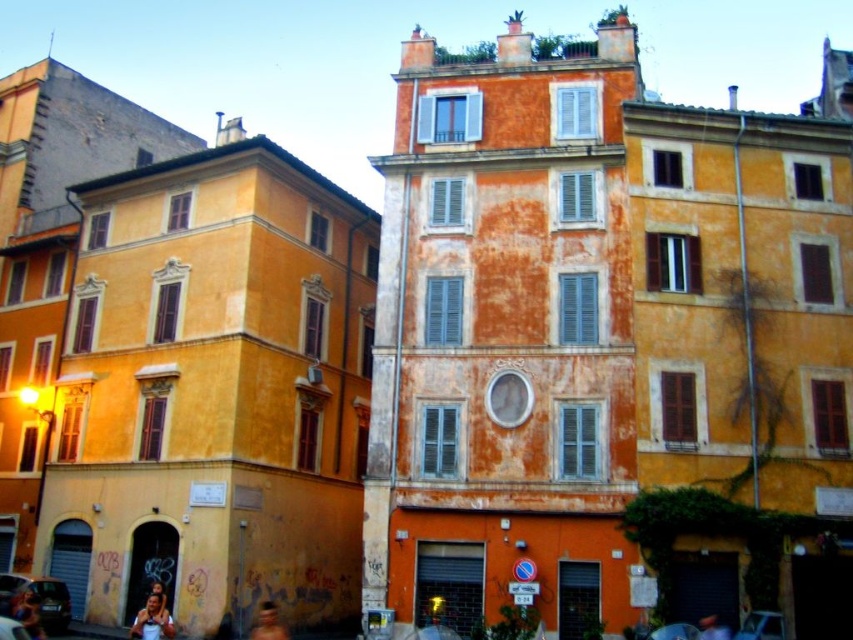
Who is positioned more to the left, smooth skin face at lower left or blurred skin at lower center?

smooth skin face at lower left is more to the left.

Does point (142, 625) come closer to viewer compared to point (260, 621)?

Yes, point (142, 625) is in front of point (260, 621).

The width and height of the screenshot is (853, 640). Describe the element at coordinates (152, 620) in the screenshot. I see `smooth skin face at lower left` at that location.

At what (x,y) coordinates should I click in order to perform the action: click on smooth skin face at lower left. Please return your answer as a coordinate pair (x, y). The width and height of the screenshot is (853, 640). Looking at the image, I should click on (152, 620).

Who is more distant from viewer, (28, 621) or (271, 612)?

Point (271, 612)

Does blue denim jeans at lower left come in front of blurred skin at lower center?

Yes, blue denim jeans at lower left is closer to the viewer.

This screenshot has height=640, width=853. Describe the element at coordinates (28, 614) in the screenshot. I see `blue denim jeans at lower left` at that location.

The height and width of the screenshot is (640, 853). Find the location of `blue denim jeans at lower left`. blue denim jeans at lower left is located at coordinates (28, 614).

Which of these two, smooth skin face at lower left or blue denim jeans at lower left, stands taller?

Standing taller between the two is blue denim jeans at lower left.

Is point (148, 636) positioned before point (24, 621)?

Yes, it is in front of point (24, 621).

Between point (151, 605) and point (22, 616), which one is positioned in front?

Positioned in front is point (151, 605).

Locate an element on the screen. smooth skin face at lower left is located at coordinates (152, 620).